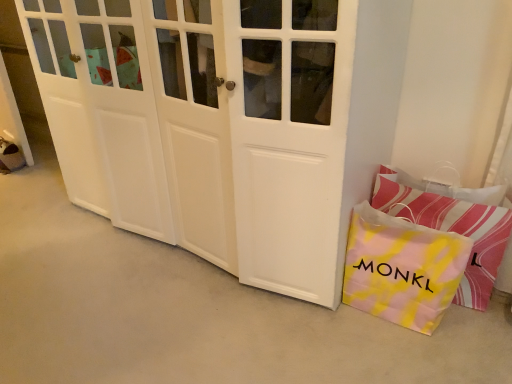
You are a GUI agent. You are given a task and a screenshot of the screen. Output one action in this format:
    pyautogui.click(x=<x>, y=<y>)
    Task: Click on the free space in front of pink striped pillow at lower right
    This screenshot has height=384, width=512.
    Given the screenshot: What is the action you would take?
    pyautogui.click(x=446, y=350)